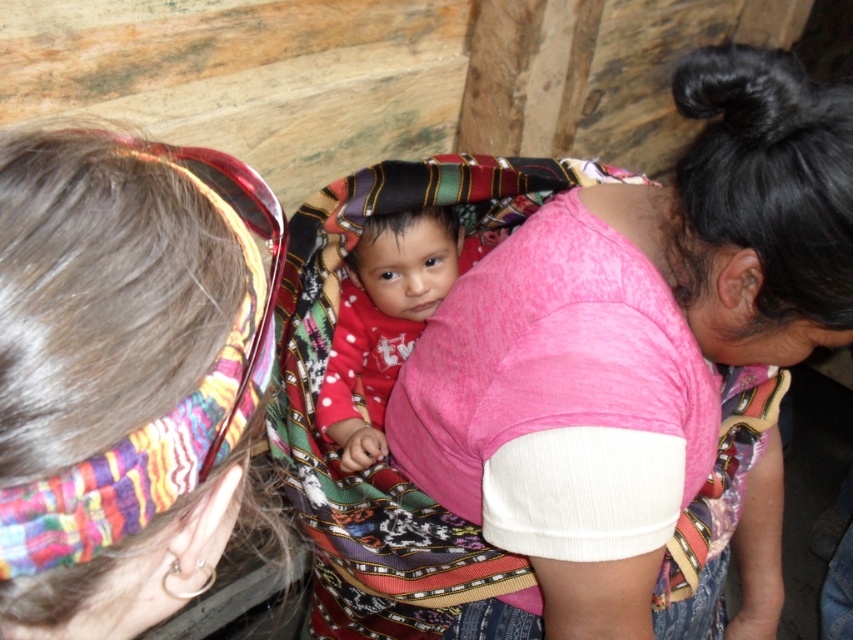
Does point (685, 484) lie behind point (54, 484)?

Yes, point (685, 484) is farther from viewer.

At what (x,y) coordinates should I click in order to perform the action: click on pink fabric at center. Please return your answer as a coordinate pair (x, y). This screenshot has width=853, height=640. Looking at the image, I should click on (631, 349).

Locate an element on the screen. This screenshot has width=853, height=640. pink fabric at center is located at coordinates (631, 349).

Which is in front, point (618, 536) or point (462, 243)?

Point (618, 536) is in front.

Is pink fabric at center taller than red polka dot fabric at center?

Yes.

Identify the location of pink fabric at center. (631, 349).

You are a GUI agent. You are given a task and a screenshot of the screen. Output one action in this format:
    pyautogui.click(x=<x>, y=<y>)
    Task: Click on the pink fabric at center
    This screenshot has width=853, height=640.
    Given the screenshot: What is the action you would take?
    pyautogui.click(x=631, y=349)

Consider the image. Does multicolored woven cloth at upper center appear over red polka dot fabric at center?

Actually, multicolored woven cloth at upper center is below red polka dot fabric at center.

Does multicolored woven cloth at upper center appear under red polka dot fabric at center?

Yes, multicolored woven cloth at upper center is below red polka dot fabric at center.

Between point (242, 204) and point (347, 378), which one is positioned behind?

Point (347, 378)

You are a GUI agent. You are given a task and a screenshot of the screen. Output one action in this format:
    pyautogui.click(x=<x>, y=<y>)
    Task: Click on the multicolored woven cloth at upper center
    This screenshot has width=853, height=640.
    Given the screenshot: What is the action you would take?
    pyautogui.click(x=123, y=376)